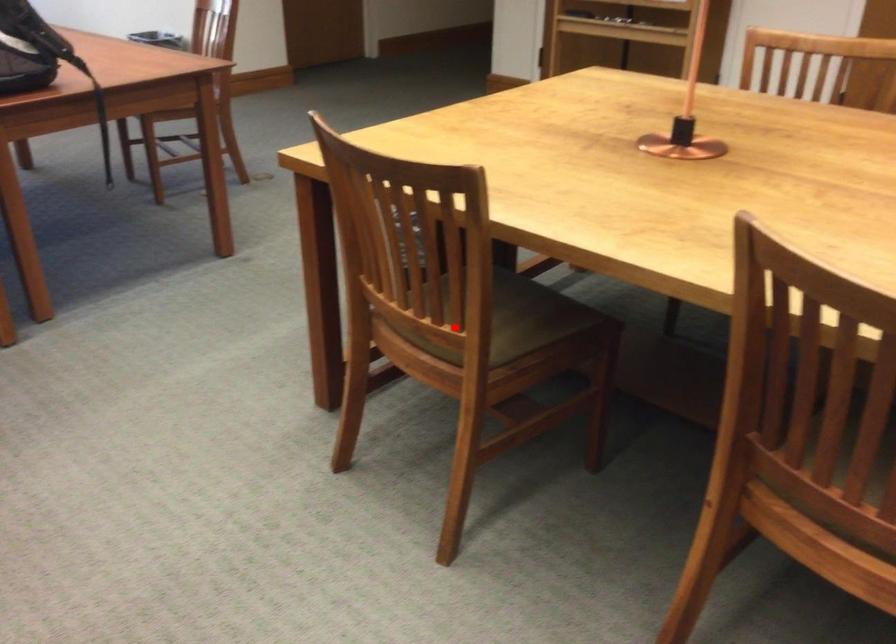
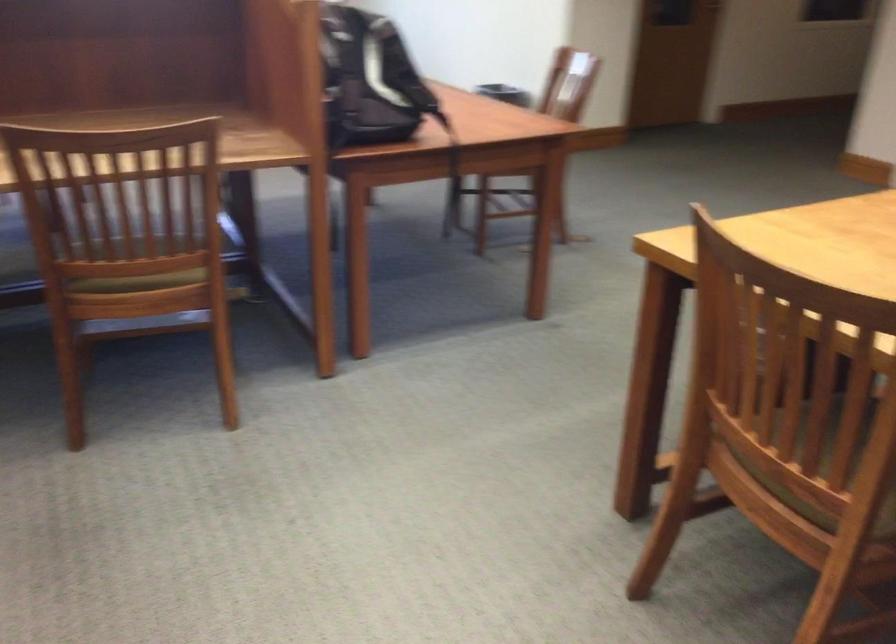
The point at the highlighted location is marked in the first image. Where is the corresponding point in the second image?

(823, 469)